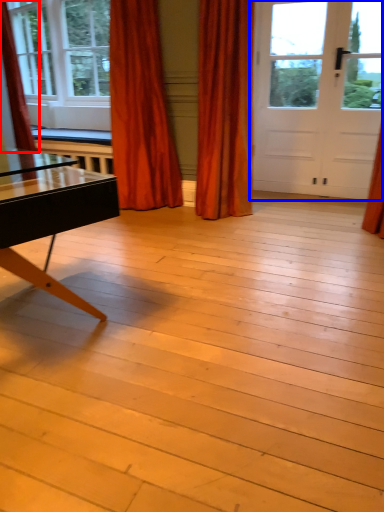
Question: Which of the following is the farthest to the observer, curtain (highlighted by a red box) or door (highlighted by a blue box)?

Choices:
 (A) curtain
 (B) door

Answer: (B)